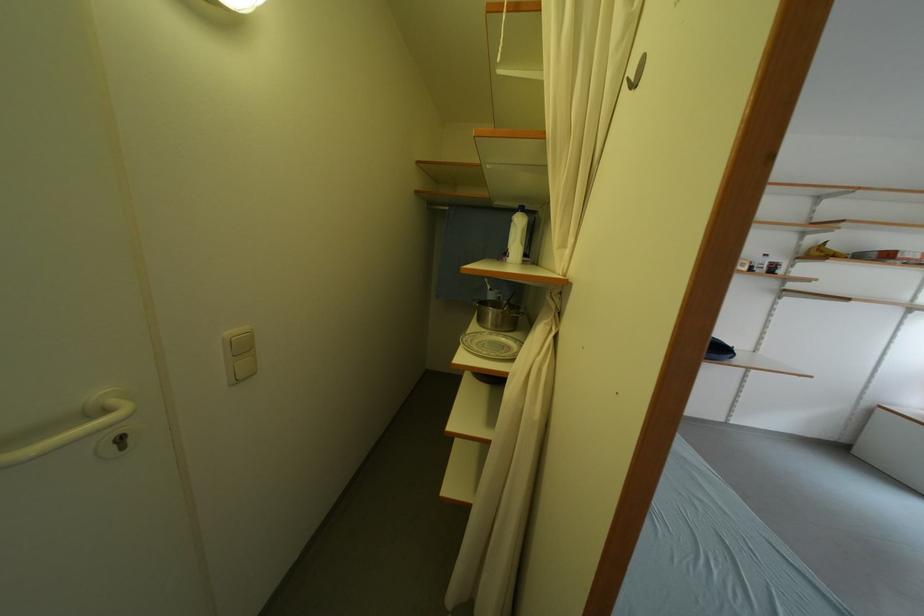
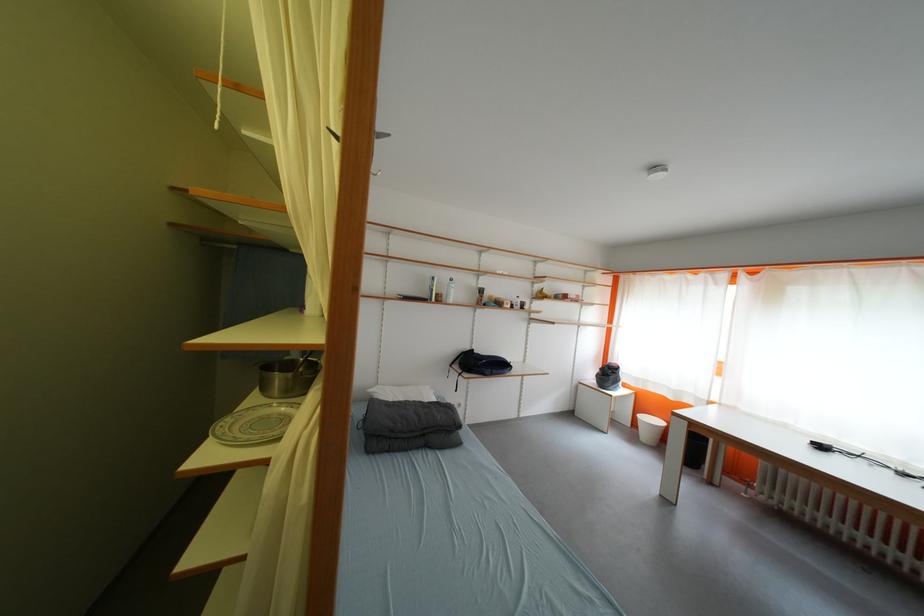
The point at (476, 339) is marked in the first image. Where is the corresponding point in the second image?

(237, 422)